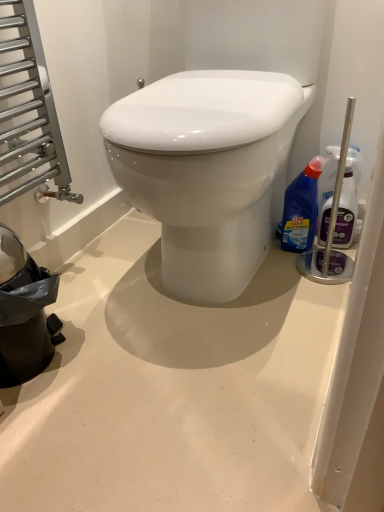
Question: Is purple plastic cleaner at right, which appears as the 1th bottle when viewed from the right, in front of or behind blue plastic bottle at right, which appears as the 2th bottle when viewed from the right, in the image?

Choices:
 (A) front
 (B) behind

Answer: (A)

Question: In terms of width, does purple plastic cleaner at right, acting as the 2th bottle starting from the left, look wider or thinner when compared to blue plastic bottle at right, which appears as the 2th bottle when viewed from the right?

Choices:
 (A) thin
 (B) wide

Answer: (A)

Question: Is purple plastic cleaner at right, acting as the 2th bottle starting from the left, bigger or smaller than blue plastic bottle at right, which is the first bottle in left-to-right order?

Choices:
 (A) big
 (B) small

Answer: (B)

Question: From a real-world perspective, is blue plastic bottle at right, which is the first bottle in left-to-right order, positioned above or below purple plastic cleaner at right, acting as the 2th bottle starting from the left?

Choices:
 (A) above
 (B) below

Answer: (B)

Question: In the image, is blue plastic bottle at right, which is the first bottle in left-to-right order, positioned in front of or behind purple plastic cleaner at right, acting as the 2th bottle starting from the left?

Choices:
 (A) behind
 (B) front

Answer: (A)

Question: Looking at the image, does blue plastic bottle at right, which appears as the 2th bottle when viewed from the right, seem bigger or smaller compared to purple plastic cleaner at right, acting as the 2th bottle starting from the left?

Choices:
 (A) small
 (B) big

Answer: (B)

Question: Is blue plastic bottle at right, which appears as the 2th bottle when viewed from the right, inside or outside of purple plastic cleaner at right, acting as the 2th bottle starting from the left?

Choices:
 (A) outside
 (B) inside

Answer: (A)